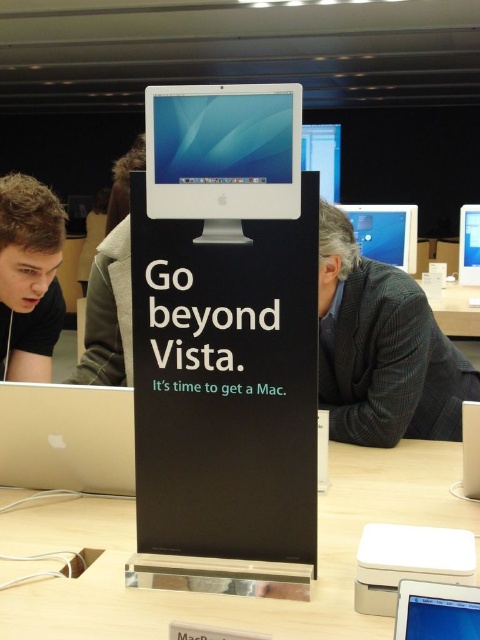
Question: Among these points, which one is farthest from the camera?

Choices:
 (A) (97, 196)
 (B) (463, 234)
 (C) (478, 403)

Answer: (A)

Question: Can you confirm if silver metallic monitor at center is positioned to the right of matte black monitor at upper center?

Choices:
 (A) yes
 (B) no

Answer: (B)

Question: Which object is closer to the camera taking this photo?

Choices:
 (A) blonde hair at left
 (B) matte black monitor at upper center
 (C) white plastic computer at center

Answer: (C)

Question: In this image, where is white glossy monitor at center located relative to light brown leather jacket at upper left?

Choices:
 (A) left
 (B) right

Answer: (B)

Question: Is blonde hair at left positioned at the back of white plastic computer at center?

Choices:
 (A) yes
 (B) no

Answer: (A)

Question: Among these objects, which one is nearest to the camera?

Choices:
 (A) white glossy monitor at center
 (B) matte black monitor at upper center

Answer: (A)